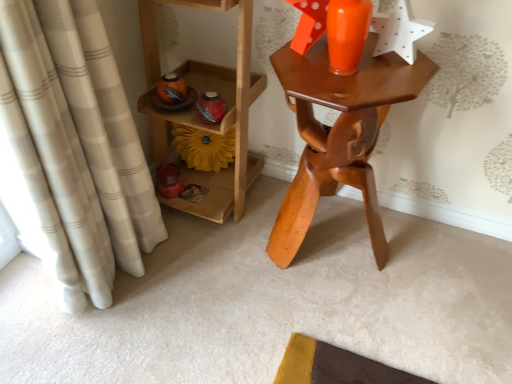
Question: Considering the relative sizes of wooden shelf at left and yellow fabric flower at center in the image provided, is wooden shelf at left bigger than yellow fabric flower at center?

Choices:
 (A) no
 (B) yes

Answer: (B)

Question: Can you confirm if wooden shelf at left is taller than yellow fabric flower at center?

Choices:
 (A) no
 (B) yes

Answer: (B)

Question: Is yellow fabric flower at center a part of wooden shelf at left?

Choices:
 (A) no
 (B) yes

Answer: (B)

Question: Is wooden shelf at left at the left side of yellow fabric flower at center?

Choices:
 (A) yes
 (B) no

Answer: (A)

Question: Is yellow fabric flower at center at the back of wooden shelf at left?

Choices:
 (A) yes
 (B) no

Answer: (A)

Question: Could you tell me if wooden shelf at left is facing yellow fabric flower at center?

Choices:
 (A) no
 (B) yes

Answer: (B)

Question: Is beige plaid curtain at left positioned before wooden table at center?

Choices:
 (A) yes
 (B) no

Answer: (A)

Question: Would you say beige plaid curtain at left contains wooden table at center?

Choices:
 (A) yes
 (B) no

Answer: (B)

Question: Can you confirm if beige plaid curtain at left is positioned to the right of wooden table at center?

Choices:
 (A) no
 (B) yes

Answer: (A)

Question: From a real-world perspective, is beige plaid curtain at left over wooden table at center?

Choices:
 (A) yes
 (B) no

Answer: (A)

Question: Is wooden table at center at the back of beige plaid curtain at left?

Choices:
 (A) yes
 (B) no

Answer: (B)

Question: From the image's perspective, is beige plaid curtain at left below wooden table at center?

Choices:
 (A) yes
 (B) no

Answer: (A)

Question: From a real-world perspective, is wooden table at center physically above beige plaid curtain at left?

Choices:
 (A) yes
 (B) no

Answer: (B)